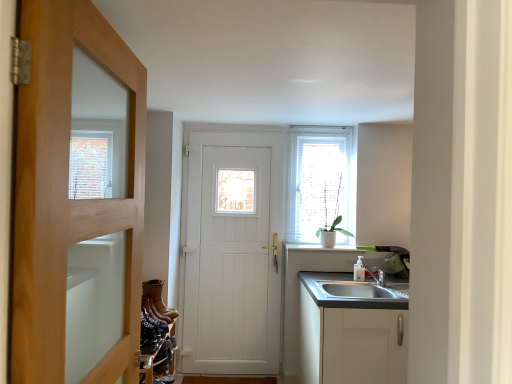
Question: Is leather boot at lower left, which appears as the 1th shoe when ordered from the bottom, in contact with white wooden door at center, which appears as the second door when viewed from the front?

Choices:
 (A) no
 (B) yes

Answer: (A)

Question: From the image's perspective, does leather boot at lower left, which is counted as the third shoe, starting from the back, appear higher than white wooden door at center, which appears as the second door when viewed from the front?

Choices:
 (A) no
 (B) yes

Answer: (A)

Question: Is leather boot at lower left, the fourth shoe from the top, turned away from white wooden door at center, which is the 1th door in back-to-front order?

Choices:
 (A) no
 (B) yes

Answer: (A)

Question: Considering the relative sizes of leather boot at lower left, which appears as the 1th shoe when ordered from the bottom, and white wooden door at center, which appears as the second door when viewed from the front, in the image provided, is leather boot at lower left, which appears as the 1th shoe when ordered from the bottom, wider than white wooden door at center, which appears as the second door when viewed from the front,?

Choices:
 (A) yes
 (B) no

Answer: (A)

Question: Does leather boot at lower left, which appears as the 1th shoe when ordered from the bottom, come behind white wooden door at center, which appears as the second door when viewed from the front?

Choices:
 (A) no
 (B) yes

Answer: (A)

Question: Does leather boot at lower left, which appears as the 1th shoe when ordered from the bottom, have a lesser width compared to white wooden door at center, which is the 1th door in back-to-front order?

Choices:
 (A) yes
 (B) no

Answer: (B)

Question: From a real-world perspective, is brown suede boot at lower left, which is the second shoe in back-to-front order, below wooden door at left, marked as the 2th door in a back-to-front arrangement?

Choices:
 (A) yes
 (B) no

Answer: (A)

Question: From the image's perspective, is brown suede boot at lower left, the 3th shoe when ordered from bottom to top, over wooden door at left, marked as the 2th door in a back-to-front arrangement?

Choices:
 (A) no
 (B) yes

Answer: (A)

Question: Is wooden door at left, acting as the 1th door starting from the front, at the back of brown suede boot at lower left, the 3th shoe when ordered from bottom to top?

Choices:
 (A) yes
 (B) no

Answer: (B)

Question: Does brown suede boot at lower left, the 3th shoe when ordered from bottom to top, appear on the right side of wooden door at left, marked as the 2th door in a back-to-front arrangement?

Choices:
 (A) no
 (B) yes

Answer: (A)

Question: Is brown suede boot at lower left, which is counted as the second shoe, starting from the top, oriented towards wooden door at left, marked as the 2th door in a back-to-front arrangement?

Choices:
 (A) no
 (B) yes

Answer: (A)

Question: Is brown suede boot at lower left, arranged as the third shoe when viewed from the front, next to wooden door at left, acting as the 1th door starting from the front, and touching it?

Choices:
 (A) yes
 (B) no

Answer: (B)

Question: Is wooden door at left, marked as the 2th door in a back-to-front arrangement, next to leather boots at lower left, positioned as the 4th shoe in bottom-to-top order, and touching it?

Choices:
 (A) yes
 (B) no

Answer: (B)